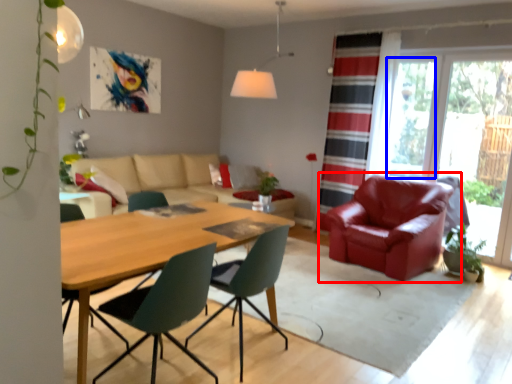
Question: Among these objects, which one is nearest to the camera, chair (highlighted by a red box) or window screen (highlighted by a blue box)?

Choices:
 (A) chair
 (B) window screen

Answer: (A)